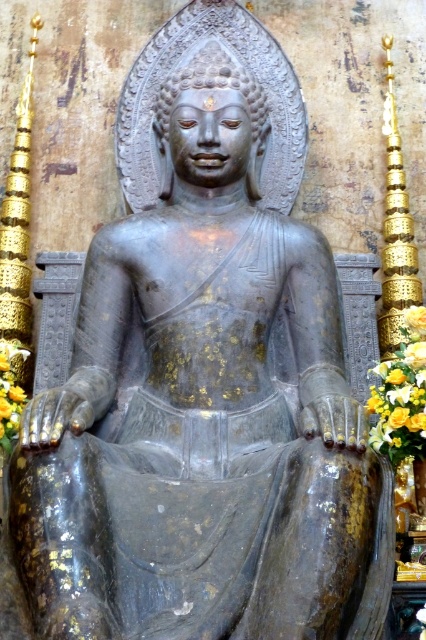
Does yellow silk flower at lower right have a greater width compared to yellow fabric at lower left?

Yes, yellow silk flower at lower right is wider than yellow fabric at lower left.

Does point (400, 413) come closer to viewer compared to point (11, 410)?

Yes, point (400, 413) is closer to viewer.

Between point (402, 412) and point (5, 385), which one is positioned in front?

Point (402, 412) is more forward.

The image size is (426, 640). In order to click on yellow silk flower at lower right in this screenshot , I will do `click(402, 394)`.